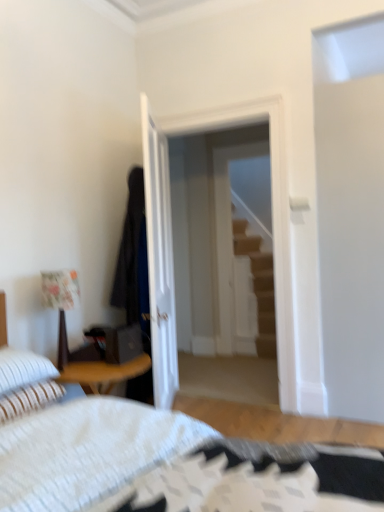
You are a GUI agent. You are given a task and a screenshot of the screen. Output one action in this format:
    pyautogui.click(x=<x>, y=<y>)
    Task: Click on the vacant point above wooden staircase at center (from a real-world perspective)
    The height and width of the screenshot is (512, 384).
    Given the screenshot: What is the action you would take?
    pyautogui.click(x=244, y=140)